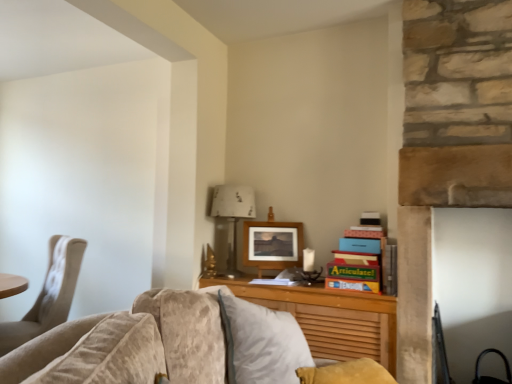
What is the approximate height of wooden at center?

wooden at center is 14.42 inches tall.

This screenshot has height=384, width=512. What do you see at coordinates (329, 318) in the screenshot?
I see `wooden desk at center` at bounding box center [329, 318].

Locate an element on the screen. The width and height of the screenshot is (512, 384). wooden at center is located at coordinates (343, 332).

Considering the relative sizes of beige fabric chair at left and wooden desk at center in the image provided, is beige fabric chair at left smaller than wooden desk at center?

No, beige fabric chair at left is not smaller than wooden desk at center.

In the scene shown: From the image's perspective, is beige fabric chair at left on top of wooden desk at center?

No, from the image's perspective, beige fabric chair at left is not above wooden desk at center.

Between beige fabric chair at left and wooden desk at center, which one has smaller width?

beige fabric chair at left.

Is beige fabric chair at left touching wooden desk at center?

There is a gap between beige fabric chair at left and wooden desk at center.

What are the coordinates of `drawer lying in front of the beige fabric chair at left` in the screenshot? It's located at (343, 332).

Can we say beige fabric chair at left lies outside wooden at center?

Yes, beige fabric chair at left is outside of wooden at center.

Which is in front, beige fabric chair at left or wooden at center?

Positioned in front is wooden at center.

Does beige fabric chair at left turn towards wooden at center?

No, beige fabric chair at left is not aimed at wooden at center.

Looking at their sizes, would you say metallic silver lamp at center is wider or thinner than wooden at center?

Clearly, metallic silver lamp at center has more width compared to wooden at center.

How different are the orientations of metallic silver lamp at center and wooden at center in degrees?

There is a 71-degree angle between the facing directions of metallic silver lamp at center and wooden at center.

Measure the distance from metallic silver lamp at center to wooden at center.

metallic silver lamp at center is 30.16 inches from wooden at center.

From the image's perspective, between metallic silver lamp at center and wooden at center, which one is located above?

metallic silver lamp at center is shown above in the image.

Is point (293, 264) closer or farther from the camera than point (372, 351)?

Point (293, 264).

Which is more to the left, wooden picture frame at center or wooden at center?

From the viewer's perspective, wooden picture frame at center appears more on the left side.

Can wooden at center be found inside wooden picture frame at center?

A: No, wooden at center is not inside wooden picture frame at center.

Considering the relative positions of wooden picture frame at center and wooden at center in the image provided, is wooden picture frame at center behind wooden at center?

Yes, it is.

How distant is wooden picture frame at center from wooden desk at center?

wooden picture frame at center and wooden desk at center are 13.85 inches apart from each other.

Is wooden picture frame at center in front of or behind wooden desk at center in the image?

Visually, wooden picture frame at center is located behind wooden desk at center.

Is wooden picture frame at center in contact with wooden desk at center?

No, wooden picture frame at center is not making contact with wooden desk at center.

Between wooden at center and beige fabric chair at left, which one has smaller size?

Smaller between the two is wooden at center.

Between wooden at center and beige fabric chair at left, which one has less height?

wooden at center.

From the picture: Which is farther from the camera, (322, 352) or (57, 247)?

The point (57, 247) is farther.

Could you tell me if wooden picture frame at center is facing beige fabric chair at left?

No, wooden picture frame at center is not facing towards beige fabric chair at left.

Is wooden picture frame at center positioned before beige fabric chair at left?

No, the depth of wooden picture frame at center is greater than that of beige fabric chair at left.

Is wooden picture frame at center taller than beige fabric chair at left?

No, wooden picture frame at center is not taller than beige fabric chair at left.

Between point (253, 256) and point (2, 337), which one is positioned in front?

The point (2, 337) is closer.

Where is `chair behind the wooden desk at center`? This screenshot has width=512, height=384. chair behind the wooden desk at center is located at coordinates (48, 294).

This screenshot has height=384, width=512. What are the coordinates of `drawer located on the right of beige fabric chair at left` in the screenshot? It's located at pyautogui.click(x=343, y=332).

Looking at the image, which one is located further to wooden at center, beige fabric chair at left or wooden desk at center?

beige fabric chair at left lies further to wooden at center than the other object.

When comparing their distances from wooden at center, does metallic silver lamp at center or wooden picture frame at center seem further?

Based on the image, metallic silver lamp at center appears to be further to wooden at center.

Considering their positions, is beige fabric chair at left positioned further to metallic silver lamp at center than wooden desk at center?

beige fabric chair at left is positioned further to the anchor metallic silver lamp at center.

Looking at the image, which one is located further to wooden picture frame at center, beige fabric chair at left or metallic silver lamp at center?

Among the two, beige fabric chair at left is located further to wooden picture frame at center.

Estimate the real-world distances between objects in this image. Which object is closer to beige fabric chair at left, wooden picture frame at center or wooden at center?

wooden picture frame at center lies closer to beige fabric chair at left than the other object.

Which object lies further to the anchor point wooden picture frame at center, wooden desk at center or beige fabric chair at left?

Based on the image, beige fabric chair at left appears to be further to wooden picture frame at center.

When comparing their distances from wooden desk at center, does wooden at center or metallic silver lamp at center seem further?

metallic silver lamp at center lies further to wooden desk at center than the other object.

Based on their spatial positions, is wooden at center or metallic silver lamp at center closer to wooden picture frame at center?

Among the two, metallic silver lamp at center is located nearer to wooden picture frame at center.

This screenshot has width=512, height=384. Identify the location of lamp between beige fabric chair at left and wooden desk at center. (233, 216).

Find the location of a particular element. The height and width of the screenshot is (384, 512). desk situated between beige fabric chair at left and wooden picture frame at center from left to right is located at coordinates (329, 318).

At what (x,y) coordinates should I click in order to perform the action: click on picture frame situated between beige fabric chair at left and wooden at center from left to right. Please return your answer as a coordinate pair (x, y). The height and width of the screenshot is (384, 512). Looking at the image, I should click on (273, 244).

Where is `lamp between beige fabric chair at left and wooden at center`? The height and width of the screenshot is (384, 512). lamp between beige fabric chair at left and wooden at center is located at coordinates (233, 216).